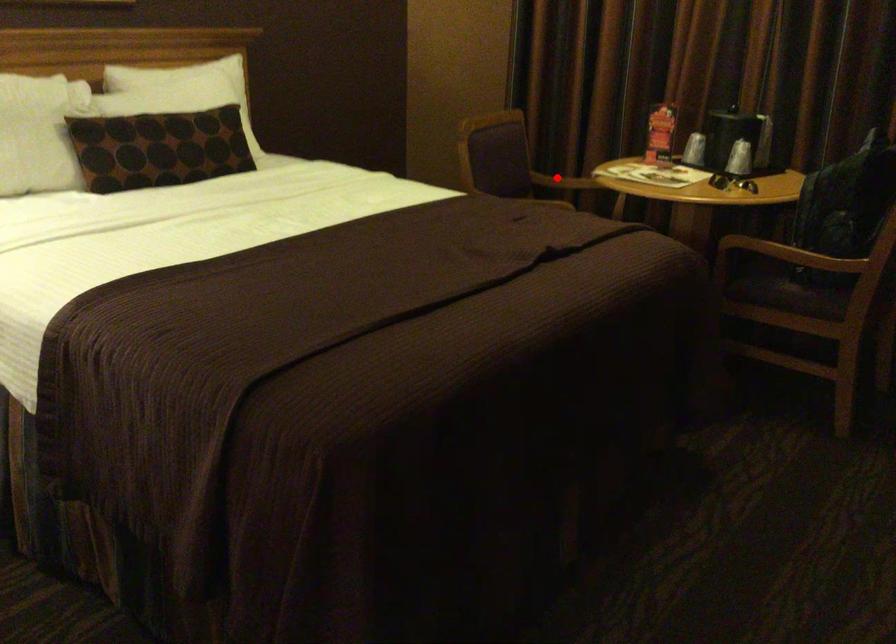
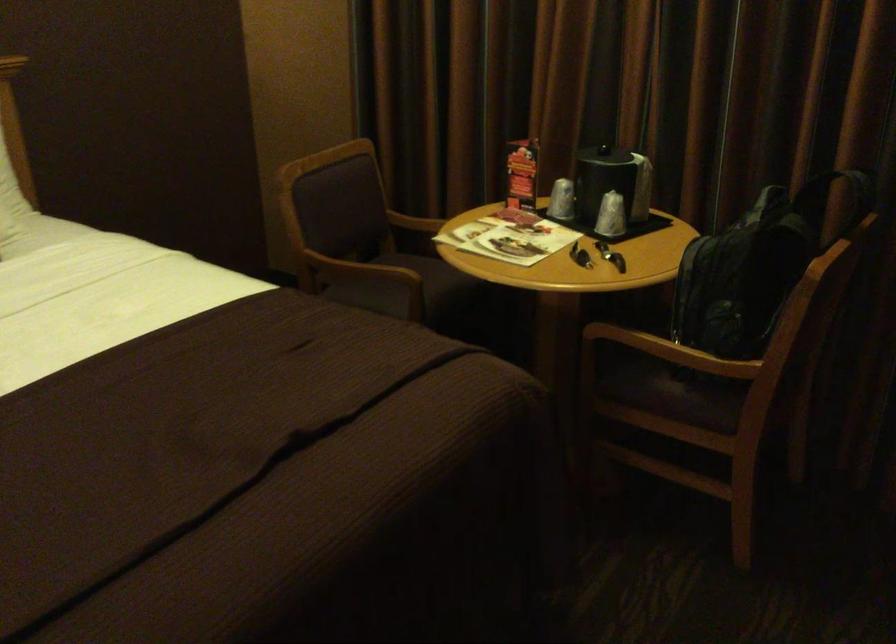
Question: I am providing you with two images of the same scene from different viewpoints. A red point is shown in image1. For the corresponding object point in image2, is it positioned nearer or farther from the camera?

Choices:
 (A) Nearer
 (B) Farther

Answer: (A)